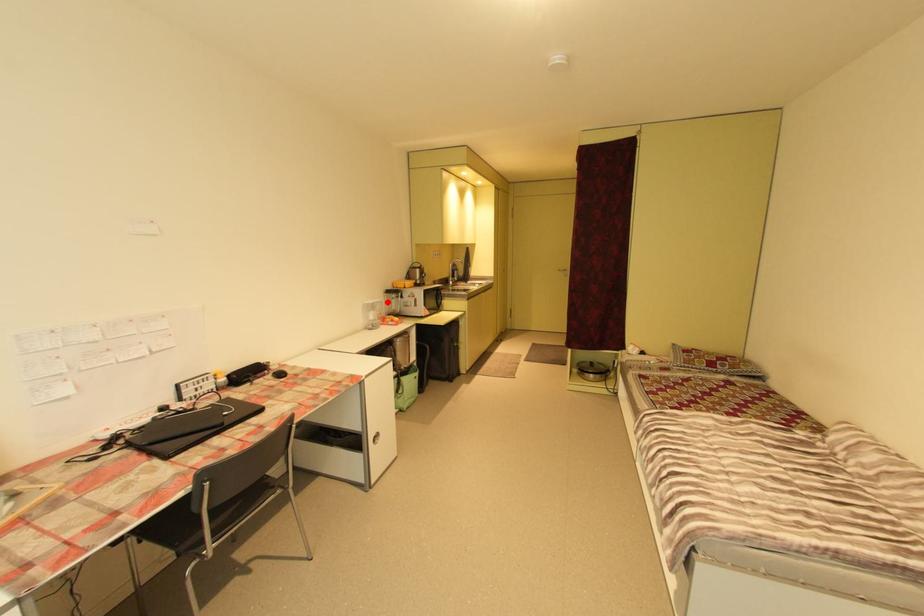
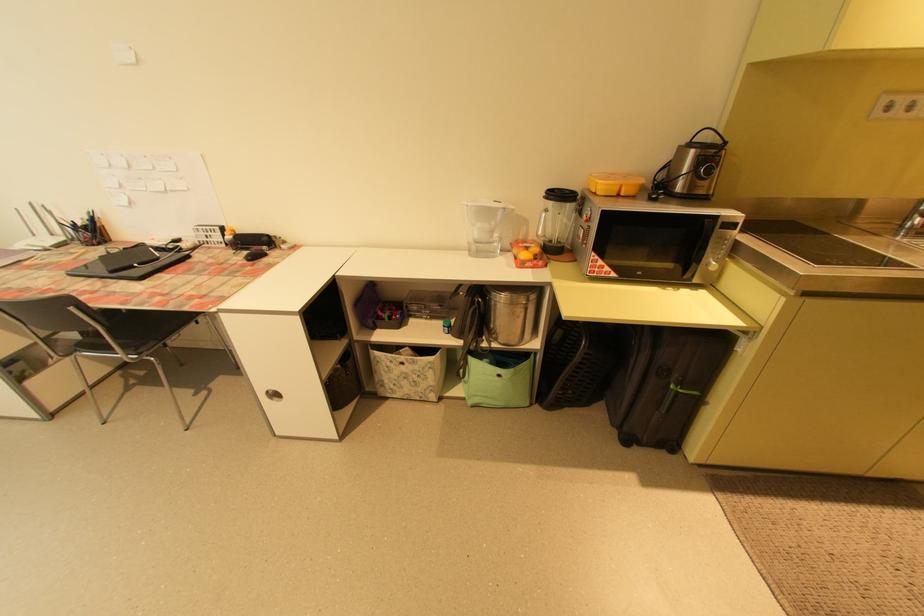
The point at the highlighted location is marked in the first image. Where is the corresponding point in the second image?

(511, 209)